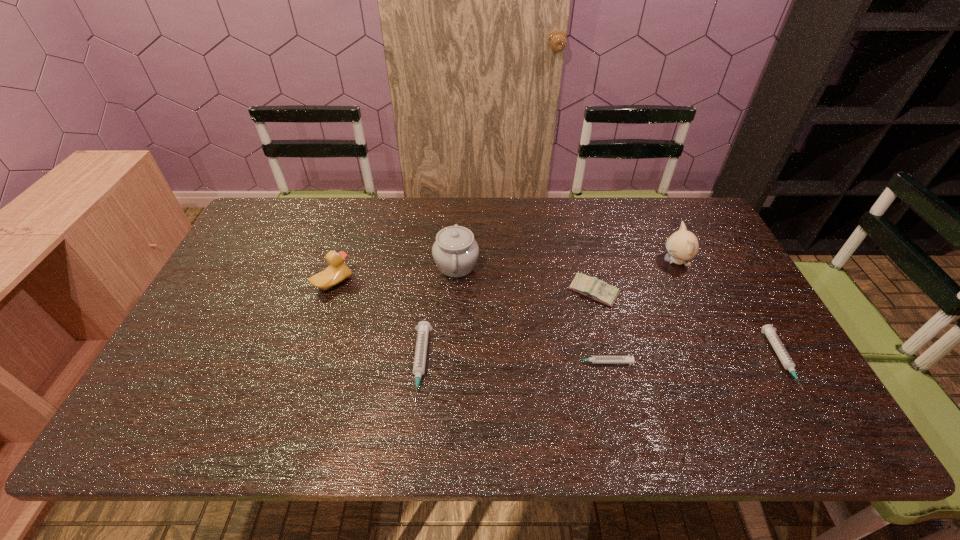
Image resolution: width=960 pixels, height=540 pixels. What are the coordinates of `vacant point located between the diary and the kitten` in the screenshot? It's located at (635, 276).

Where is `free spot between the rightmost syringe and the diary`? This screenshot has width=960, height=540. free spot between the rightmost syringe and the diary is located at coordinates (687, 326).

At what (x,y) coordinates should I click in order to perform the action: click on vacant area that lies between the chinaware and the second syringe from left to right. Please return your answer as a coordinate pair (x, y). The height and width of the screenshot is (540, 960). Looking at the image, I should click on (529, 314).

Locate an element on the screen. Image resolution: width=960 pixels, height=540 pixels. free space between the second tallest syringe and the fourth tallest object is located at coordinates (687, 326).

In order to click on vacant area that lies between the fifth tallest object and the duck in this screenshot , I will do `click(377, 323)`.

At what (x,y) coordinates should I click in order to perform the action: click on free space between the second syringe from left to right and the second shortest syringe. Please return your answer as a coordinate pair (x, y). Looking at the image, I should click on (692, 361).

I want to click on vacant space that is in between the shortest object and the chinaware, so click(x=529, y=314).

Select which object is the fourth closest to the fourth shortest object. Please provide its 2D coordinates. Your answer should be formatted as a tuple, i.e. [(x, y)], where the tuple contains the x and y coordinates of a point satisfying the conditions above.

[(768, 330)]

Identify which object is the sixth nearest to the second syringe from right to left. Please provide its 2D coordinates. Your answer should be formatted as a tuple, i.e. [(x, y)], where the tuple contains the x and y coordinates of a point satisfying the conditions above.

[(337, 271)]

What are the coordinates of `syringe that is the second nearest to the chinaware` in the screenshot? It's located at (594, 359).